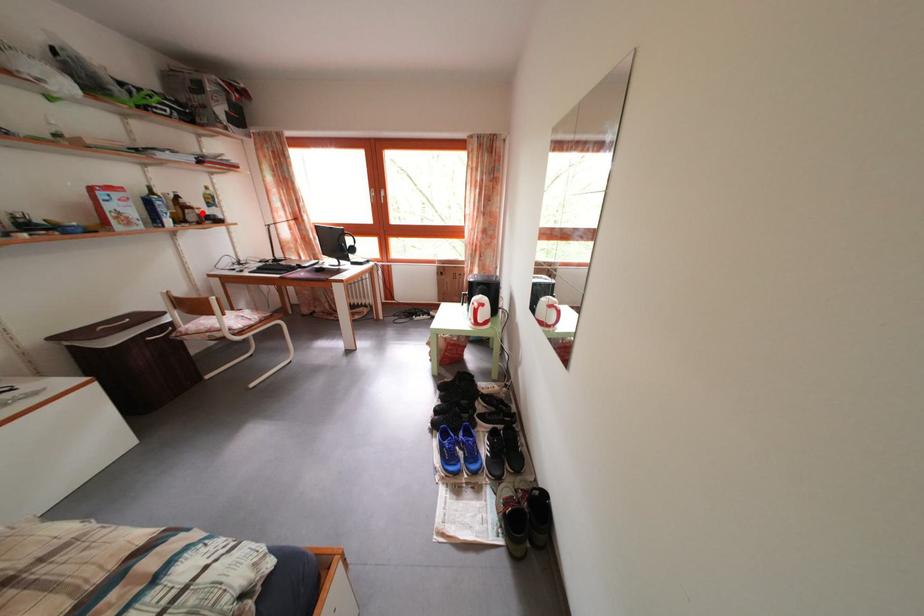
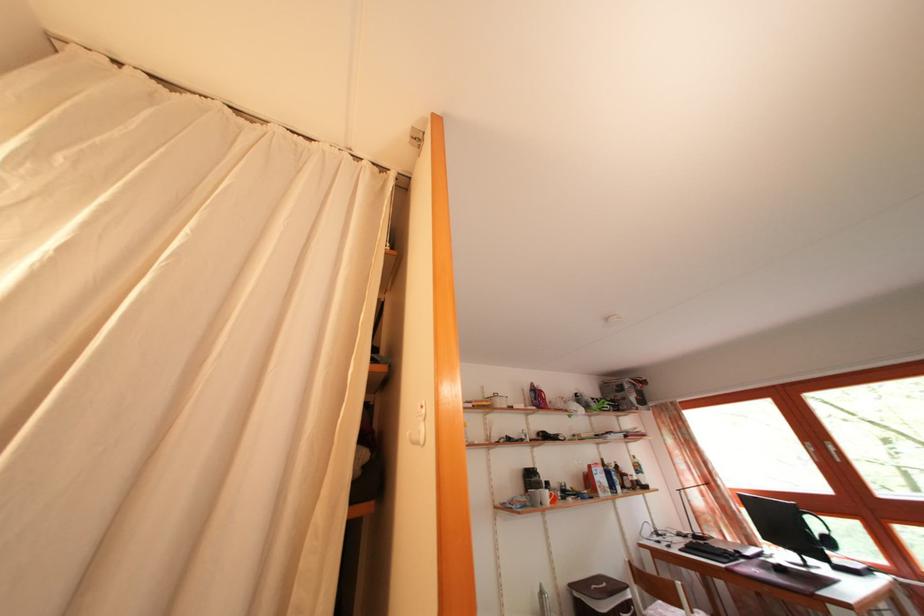
Where in the second image is the point corresponding to the highlighted location from the first image?

(636, 480)